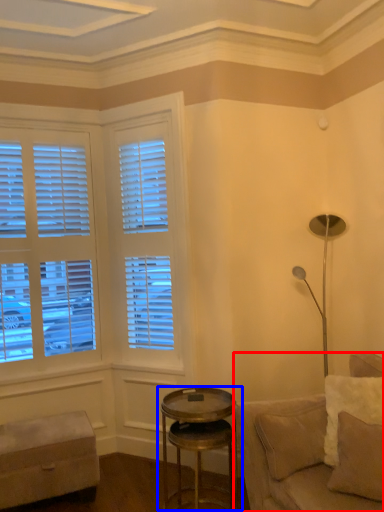
Question: Which of the following is the closest to the observer, studio couch (highlighted by a red box) or table (highlighted by a blue box)?

Choices:
 (A) studio couch
 (B) table

Answer: (A)